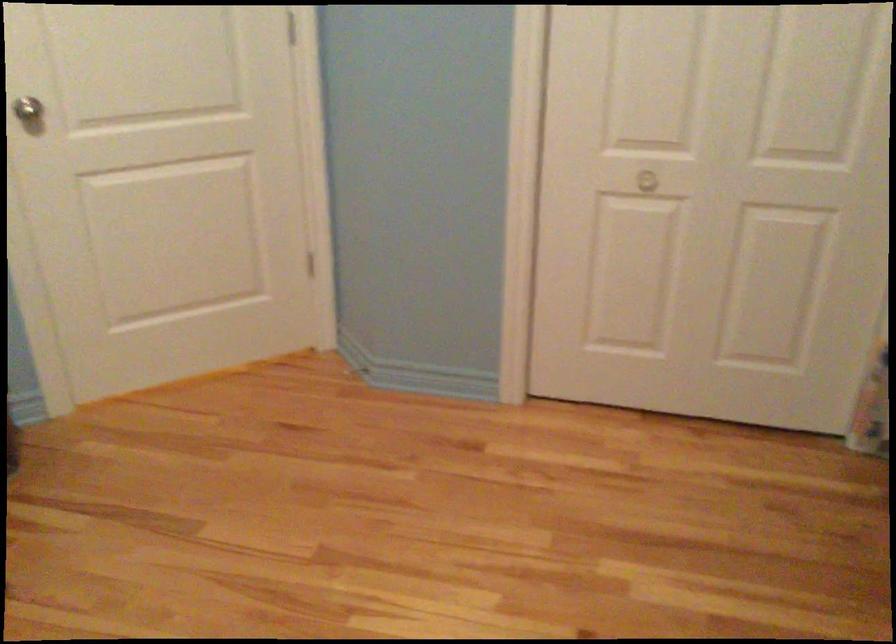
At what (x,y) coordinates should I click in order to perform the action: click on recessed door handle. Please return your answer as a coordinate pair (x, y). The image size is (896, 644). Looking at the image, I should click on coord(658,176).